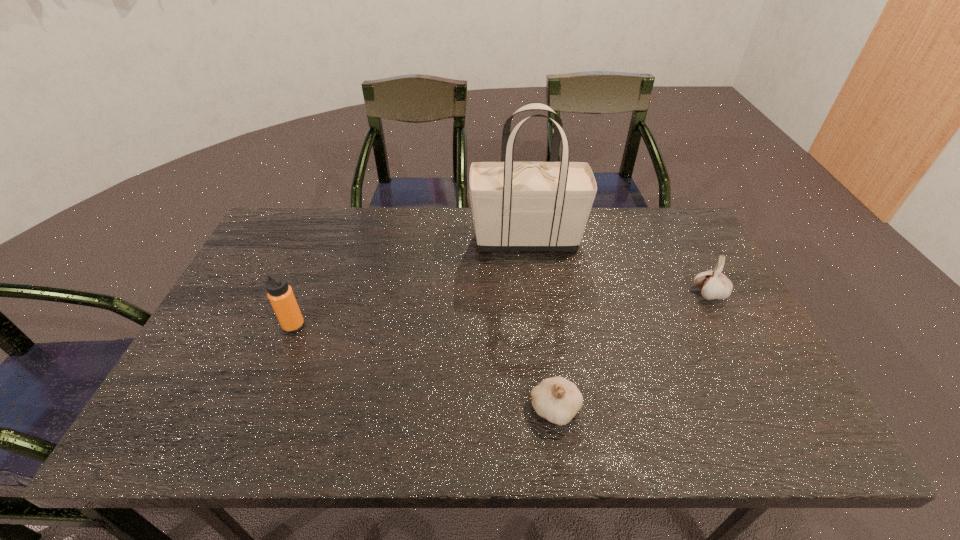
Where is `shopping bag`? The width and height of the screenshot is (960, 540). shopping bag is located at coordinates (517, 206).

Where is `the tallest object`? Image resolution: width=960 pixels, height=540 pixels. the tallest object is located at coordinates (517, 206).

At what (x,y) coordinates should I click in order to perform the action: click on the third shortest object. Please return your answer as a coordinate pair (x, y). Looking at the image, I should click on (280, 294).

Locate an element on the screen. The height and width of the screenshot is (540, 960). the second nearest object is located at coordinates (280, 294).

Locate an element on the screen. The height and width of the screenshot is (540, 960). the rightmost object is located at coordinates (713, 284).

Locate an element on the screen. This screenshot has width=960, height=540. the right garlic is located at coordinates (713, 284).

Locate an element on the screen. Image resolution: width=960 pixels, height=540 pixels. the shorter garlic is located at coordinates (558, 400).

At what (x,y) coordinates should I click in order to perform the action: click on the shortest object. Please return your answer as a coordinate pair (x, y). The width and height of the screenshot is (960, 540). Looking at the image, I should click on (558, 400).

The image size is (960, 540). In order to click on blank space located with handles facing forward on the farthest object in this screenshot , I will do `click(414, 239)`.

At what (x,y) coordinates should I click in order to perform the action: click on vacant space located with handles facing forward on the farthest object. Please return your answer as a coordinate pair (x, y). This screenshot has height=540, width=960. Looking at the image, I should click on (418, 239).